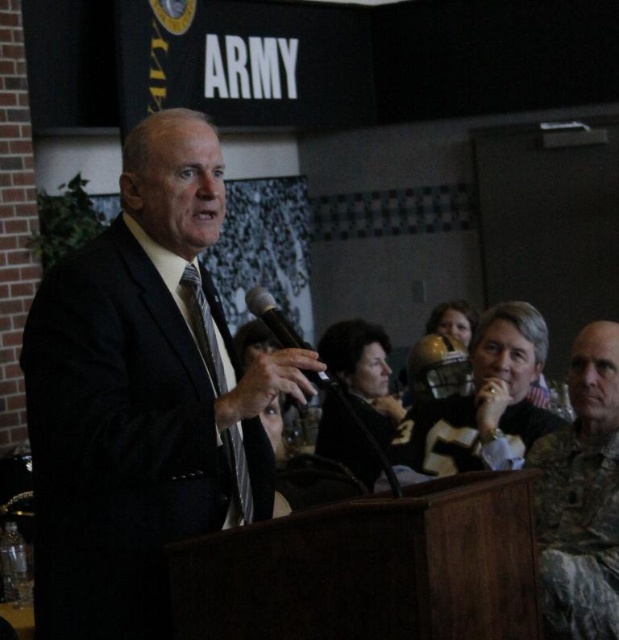
Looking at this image, based on the scene description, where is the dark suit at center located in terms of coordinates?

The dark suit at center is located at point coordinates of (142, 396).